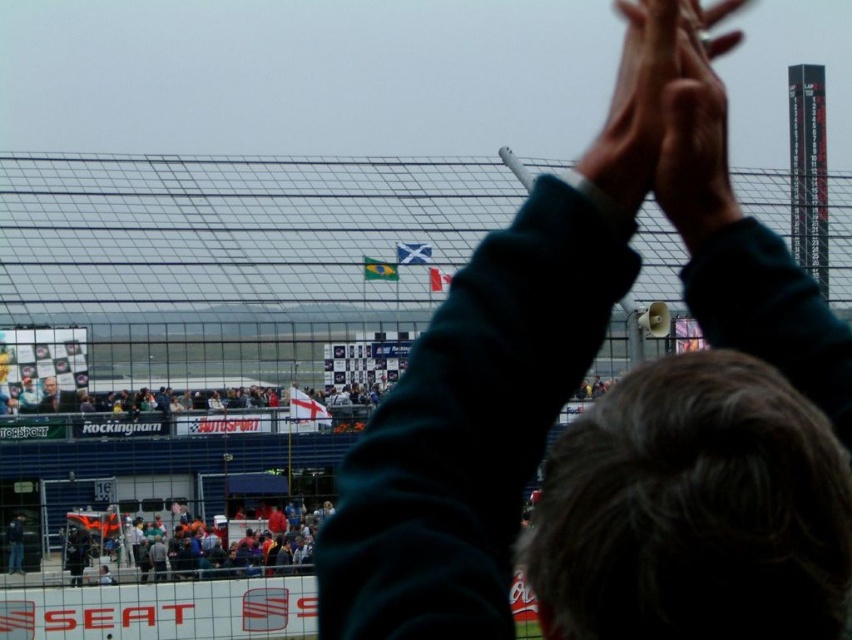
You are a photographer at the motorsport event. You want to capture a photo that includes both the smooth skin hands at upper center and the multicolored fabric crowd at lower center. Which object should you focus on first to ensure both are in frame?

The smooth skin hands at upper center is taller than the multicolored fabric crowd at lower center, so you should focus on the smooth skin hands at upper center first to ensure both are in frame.

You are a photographer at the motorsport event. You want to capture a photo that includes both the dark green sweater at upper center and the smooth skin hands at upper center. Which object should you focus on first to ensure both are in frame?

The dark green sweater at upper center is much taller than the smooth skin hands at upper center. To ensure both are in frame, focus on the taller object first, which is the dark green sweater at upper center.